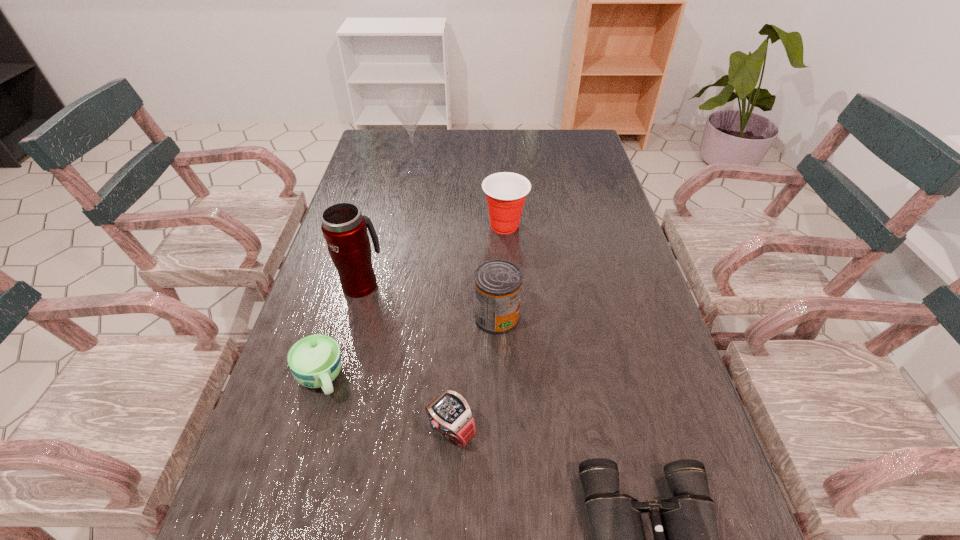
Locate an element on the screen. object positioned at the far left corner is located at coordinates (408, 104).

Identify the location of vacant space at the far edge. Image resolution: width=960 pixels, height=540 pixels. (473, 159).

In the image, there is a desktop. What are the coordinates of `vacant space at the left edge` in the screenshot? It's located at (298, 518).

The image size is (960, 540). Identify the location of free region at the right edge. (633, 325).

This screenshot has width=960, height=540. I want to click on free location at the far left corner, so click(397, 148).

Locate an element on the screen. Image resolution: width=960 pixels, height=540 pixels. free space at the far right corner of the desktop is located at coordinates (577, 130).

Locate an element on the screen. empty location between the shorter cup and the thermos bottle is located at coordinates (342, 331).

Identify the location of empty space that is in between the third farthest object and the shorter cup. 342,331.

In order to click on free point between the can and the fifth nearest object in this screenshot , I will do coord(429,300).

Where is `free space between the left cup and the can`? free space between the left cup and the can is located at coordinates (409, 348).